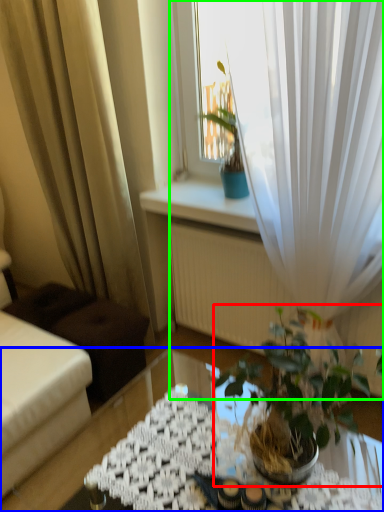
Question: Based on their relative distances, which object is farther from houseplant (highlighted by a red box)? Choose from table (highlighted by a blue box) and curtain (highlighted by a green box).

Choices:
 (A) table
 (B) curtain

Answer: (A)